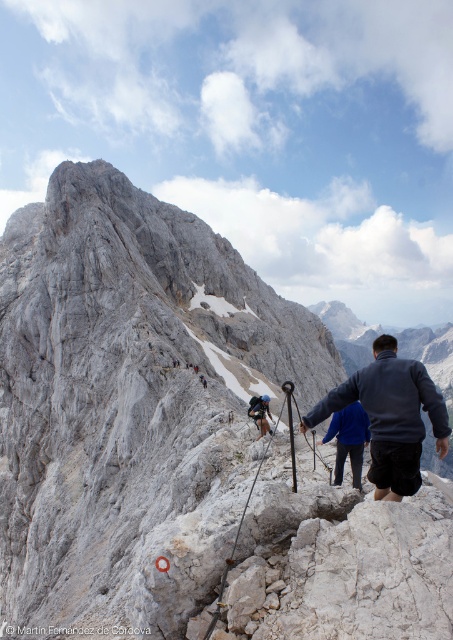
Question: Does dark gray jacket at center have a smaller size compared to dark blue jacket at center?

Choices:
 (A) no
 (B) yes

Answer: (A)

Question: From the image, what is the correct spatial relationship of dark gray jacket at center in relation to dark blue jacket at center?

Choices:
 (A) left
 (B) right

Answer: (B)

Question: Which point is farther to the camera?

Choices:
 (A) (374, 348)
 (B) (255, 396)

Answer: (B)

Question: Is dark gray jacket at center smaller than dark blue jacket at center?

Choices:
 (A) yes
 (B) no

Answer: (B)

Question: Which of the following is the farthest from the observer?

Choices:
 (A) (313, 406)
 (B) (247, 412)

Answer: (B)